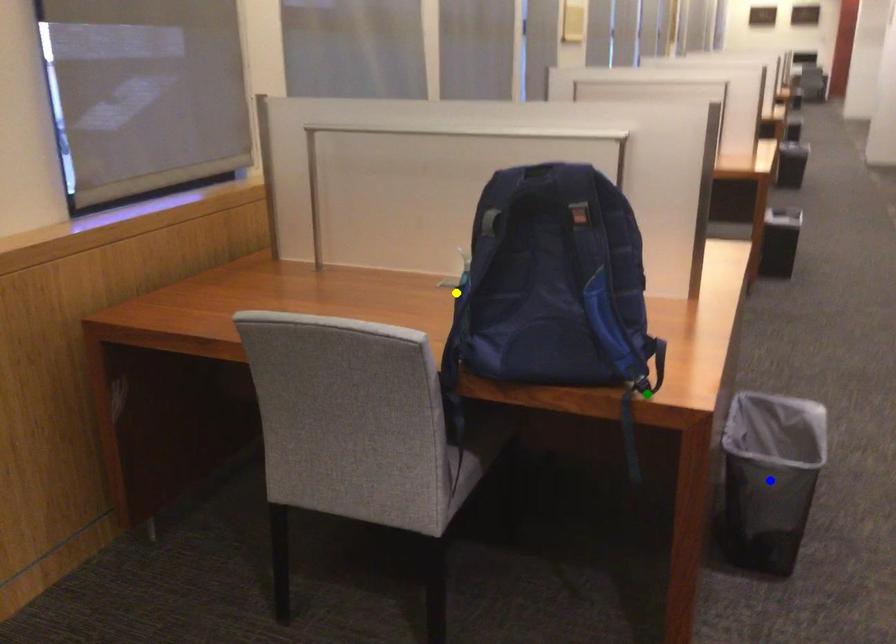
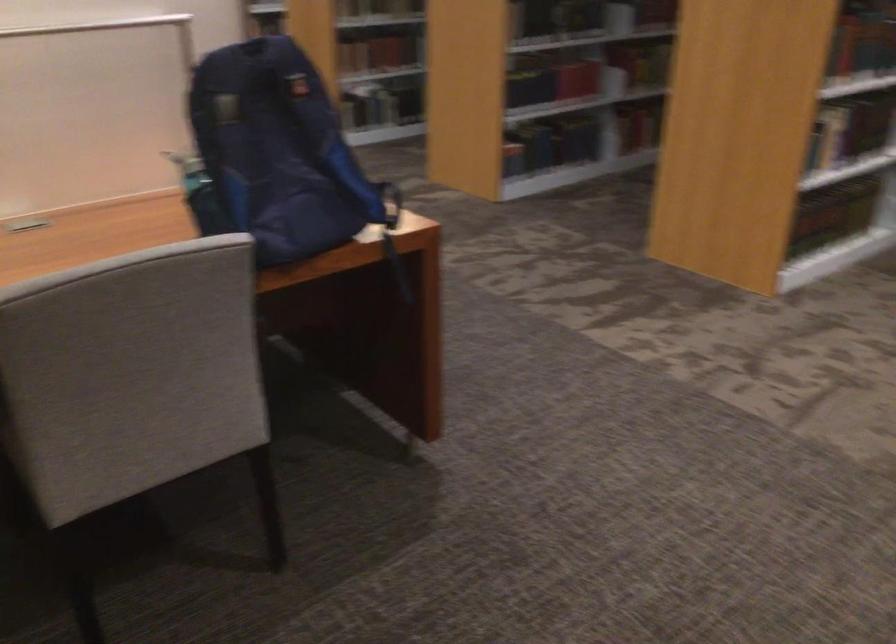
I am providing you with two images of the same scene from different viewpoints. Three points are marked in image1. Which point corresponds to a part or object that is occluded in image2?In image1, three points are marked. Which of them correspond to a part or object that is occluded in image2?Among the three points shown in image1, which one corresponds to a part or object that is no longer visible due to occlusion in image2?

blue point